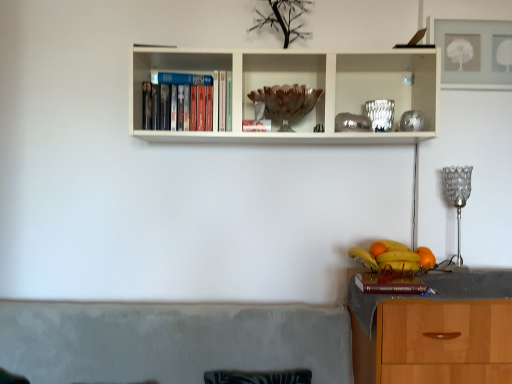
This screenshot has height=384, width=512. What do you see at coordinates (389, 283) in the screenshot? I see `hardcover book at lower right` at bounding box center [389, 283].

Measure the distance between yellow matte bananas at lower right and camera.

The depth of yellow matte bananas at lower right is 1.55 meters.

This screenshot has height=384, width=512. I want to click on silver metallic lamp at right, so pos(458,201).

Based on the photo, what is the approximate width of brown wooden bowl at center?

The width of brown wooden bowl at center is 9.57 inches.

Measure the distance between point (376,244) and camera.

They are 6.19 feet apart.

What is the approximate height of orange matte at right, which appears as the 1th orange when viewed from the back?

2.66 inches.

Find the location of `hardcover book at lower right`. hardcover book at lower right is located at coordinates [x=389, y=283].

From a real-world perspective, which object rests below the other?

hardcover book at lower right is physically lower.

Is yellow matte bananas at lower right wider than hardcover book at lower right?

Yes.

Is yellow matte bananas at lower right bigger or smaller than hardcover book at lower right?

Considering their sizes, yellow matte bananas at lower right takes up more space than hardcover book at lower right.

Considering the relative sizes of orange matte at right, the first orange from the left, and orange matte at right, arranged as the second orange when viewed from the left, in the image provided, is orange matte at right, the first orange from the left, wider than orange matte at right, arranged as the second orange when viewed from the left,?

Indeed, orange matte at right, the first orange from the left, has a greater width compared to orange matte at right, arranged as the second orange when viewed from the left.

Does orange matte at right, the second orange in the right-to-left sequence, have a larger size compared to orange matte at right, which is the first orange in front-to-back order?

No, orange matte at right, the second orange in the right-to-left sequence, is not bigger than orange matte at right, which is the first orange in front-to-back order.

At what (x,y) coordinates should I click in order to perform the action: click on orange located below the orange matte at right, arranged as the second orange when viewed from the front (from the image's perspective). Please return your answer as a coordinate pair (x, y). This screenshot has height=384, width=512. Looking at the image, I should click on pyautogui.click(x=425, y=257).

How different are the orientations of orange matte at right, the second orange in the right-to-left sequence, and orange matte at right, which is the first orange in front-to-back order, in degrees?

The angular difference between orange matte at right, the second orange in the right-to-left sequence, and orange matte at right, which is the first orange in front-to-back order, is 0.000137 degrees.

Are orange matte at right, arranged as the second orange when viewed from the left, and clear glass vase at upper center making contact?

No, orange matte at right, arranged as the second orange when viewed from the left, is not making contact with clear glass vase at upper center.

From a real-world perspective, is orange matte at right, the 2th orange positioned from the back, located beneath clear glass vase at upper center?

Yes, from a real-world perspective, orange matte at right, the 2th orange positioned from the back, is below clear glass vase at upper center.

Is orange matte at right, the 1th orange from the right, located outside clear glass vase at upper center?

Absolutely, orange matte at right, the 1th orange from the right, is external to clear glass vase at upper center.

Is silver metallic lamp at right facing towards yellow matte bananas at lower right?

No.

Considering the sizes of silver metallic lamp at right and yellow matte bananas at lower right in the image, is silver metallic lamp at right wider or thinner than yellow matte bananas at lower right?

Considering their sizes, silver metallic lamp at right looks slimmer than yellow matte bananas at lower right.

Consider the image. Is silver metallic lamp at right far from yellow matte bananas at lower right?

Actually, silver metallic lamp at right and yellow matte bananas at lower right are a little close together.

Would you say silver metallic lamp at right is to the left or to the right of yellow matte bananas at lower right in the picture?

Based on their positions, silver metallic lamp at right is located to the right of yellow matte bananas at lower right.

Which of these two, brown wooden bowl at center or orange matte at right, the second orange in the right-to-left sequence, is wider?

brown wooden bowl at center.

Based on the photo, would you say brown wooden bowl at center is to the left or to the right of orange matte at right, the first orange from the left, in the picture?

In the image, brown wooden bowl at center appears on the left side of orange matte at right, the first orange from the left.

Image resolution: width=512 pixels, height=384 pixels. Find the location of `cabinet above the orange matte at right, arranged as the second orange when viewed from the front (from the image's perspective)`. cabinet above the orange matte at right, arranged as the second orange when viewed from the front (from the image's perspective) is located at coordinates (280, 73).

Is brown wooden bowl at center taller or shorter than orange matte at right, the first orange from the left?

Considering their sizes, brown wooden bowl at center has more height than orange matte at right, the first orange from the left.

Between clear glass vase at upper center and brown wooden bowl at center, which one is positioned behind?

clear glass vase at upper center.

From a real-world perspective, who is located lower, clear glass vase at upper center or brown wooden bowl at center?

From a 3D spatial view, clear glass vase at upper center is below.

Locate an element on the screen. cabinet located above the clear glass vase at upper center (from a real-world perspective) is located at coordinates (280, 73).

From the image's perspective, which one is positioned higher, clear glass vase at upper center or brown wooden bowl at center?

From the image's view, brown wooden bowl at center is above.

Based on the photo, is silver metallic lamp at right next to orange matte at right, which is the first orange in front-to-back order, and touching it?

No, silver metallic lamp at right is not touching orange matte at right, which is the first orange in front-to-back order.

From the image's perspective, is silver metallic lamp at right positioned above or below orange matte at right, which is the first orange in front-to-back order?

silver metallic lamp at right is above orange matte at right, which is the first orange in front-to-back order.

Is orange matte at right, the 2th orange positioned from the back, completely or partially inside silver metallic lamp at right?

No, orange matte at right, the 2th orange positioned from the back, is located outside of silver metallic lamp at right.

Does point (462, 199) come closer to viewer compared to point (426, 248)?

No.

In order to click on book to the left of yellow matte bananas at lower right in this screenshot , I will do `click(389, 283)`.

At what (x,y) coordinates should I click in order to perform the action: click on orange behind the orange matte at right, which is the first orange in front-to-back order. Please return your answer as a coordinate pair (x, y). Looking at the image, I should click on (377, 249).

In the scene shown: When comparing their distances from hardcover book at lower right, does orange matte at right, the second orange in the right-to-left sequence, or orange matte at right, arranged as the second orange when viewed from the left, seem closer?

orange matte at right, arranged as the second orange when viewed from the left, is closer to hardcover book at lower right.

Based on their spatial positions, is orange matte at right, arranged as the second orange when viewed from the front, or yellow matte bananas at lower right further from silver metallic lamp at right?

Among the two, orange matte at right, arranged as the second orange when viewed from the front, is located further to silver metallic lamp at right.

Estimate the real-world distances between objects in this image. Which object is closer to brown wooden bowl at center, silver metallic lamp at right or hardcover book at lower right?

The object closer to brown wooden bowl at center is silver metallic lamp at right.

Looking at the image, which one is located further to brown wooden bowl at center, orange matte at right, which appears as the 1th orange when viewed from the back, or yellow matte bananas at lower right?

Among the two, orange matte at right, which appears as the 1th orange when viewed from the back, is located further to brown wooden bowl at center.

Considering their positions, is silver metallic lamp at right positioned further to orange matte at right, the 1th orange from the right, than clear glass vase at upper center?

clear glass vase at upper center is positioned further to the anchor orange matte at right, the 1th orange from the right.

Based on their spatial positions, is brown wooden bowl at center or orange matte at right, the first orange from the left, closer to hardcover book at lower right?

Based on the image, orange matte at right, the first orange from the left, appears to be nearer to hardcover book at lower right.

Based on their spatial positions, is silver metallic lamp at right or clear glass vase at upper center further from orange matte at right, the first orange from the left?

Among the two, clear glass vase at upper center is located further to orange matte at right, the first orange from the left.

Based on their spatial positions, is orange matte at right, which is the first orange in front-to-back order, or orange matte at right, the second orange in the right-to-left sequence, closer to brown wooden bowl at center?

The object closer to brown wooden bowl at center is orange matte at right, the second orange in the right-to-left sequence.

Where is `fruit situated between hardcover book at lower right and silver metallic lamp at right from left to right`? Image resolution: width=512 pixels, height=384 pixels. fruit situated between hardcover book at lower right and silver metallic lamp at right from left to right is located at coordinates (393, 256).

Locate an element on the screen. fruit between orange matte at right, the second orange in the right-to-left sequence, and orange matte at right, which is the first orange in front-to-back order, in the horizontal direction is located at coordinates (393, 256).

Where is `orange between hardcover book at lower right and orange matte at right, which is the first orange in front-to-back order, in the horizontal direction`? orange between hardcover book at lower right and orange matte at right, which is the first orange in front-to-back order, in the horizontal direction is located at coordinates (377, 249).

Identify the location of lamp that lies between clear glass vase at upper center and yellow matte bananas at lower right from top to bottom. (458, 201).